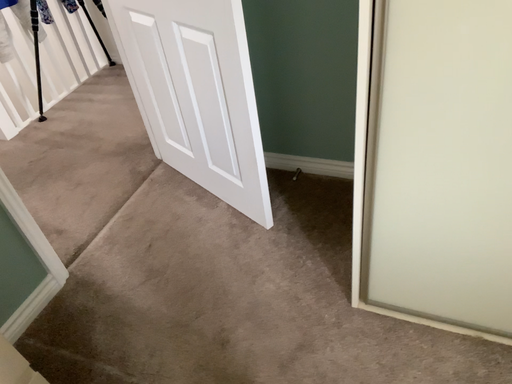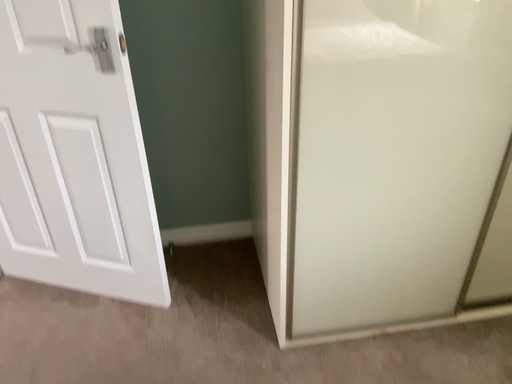
Question: Which way did the camera rotate in the video?

Choices:
 (A) rotated upward
 (B) rotated downward

Answer: (A)